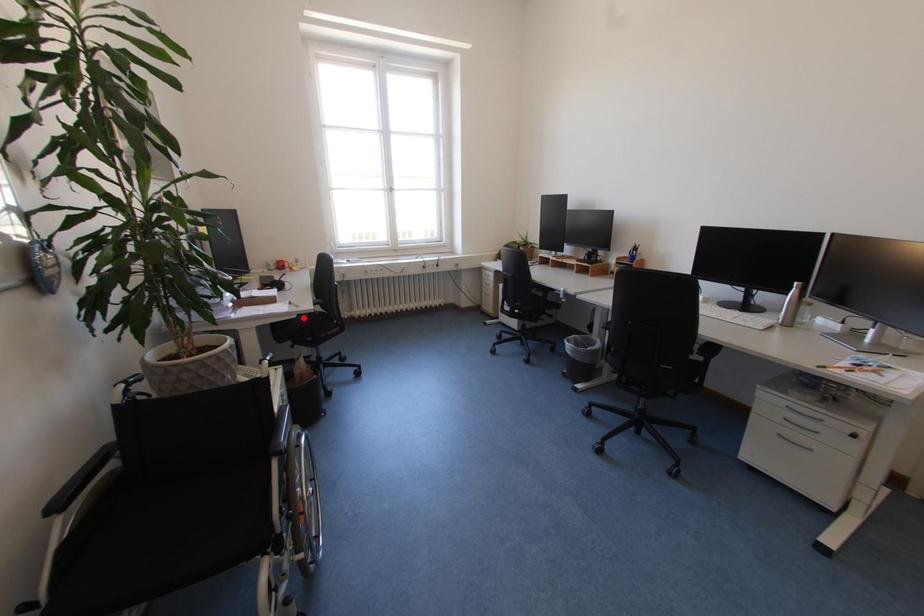
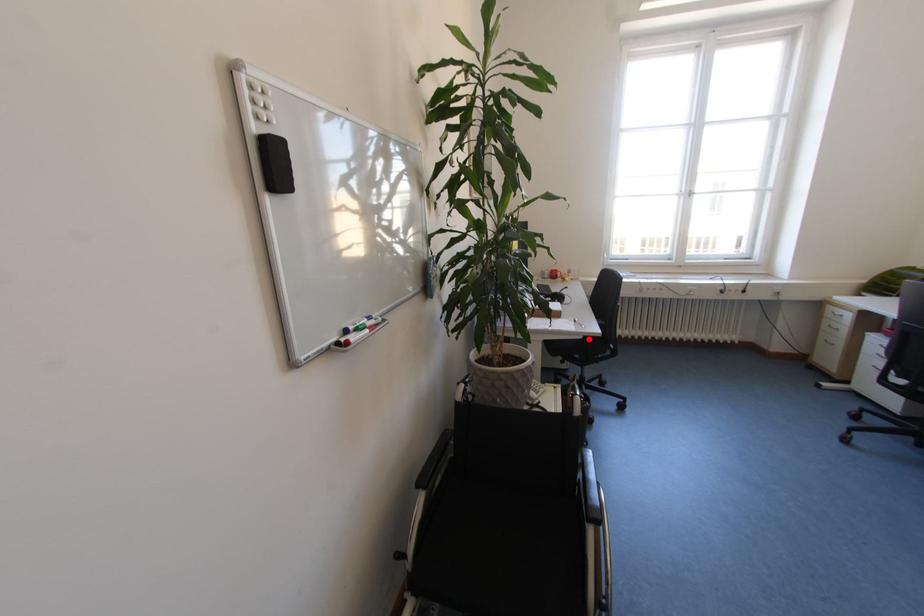
I am providing you with two images of the same scene from different viewpoints. A red point is marked on the first image and another point is marked on the second image. Are the points marked in image1 and image2 representing the same 3D position?

Yes